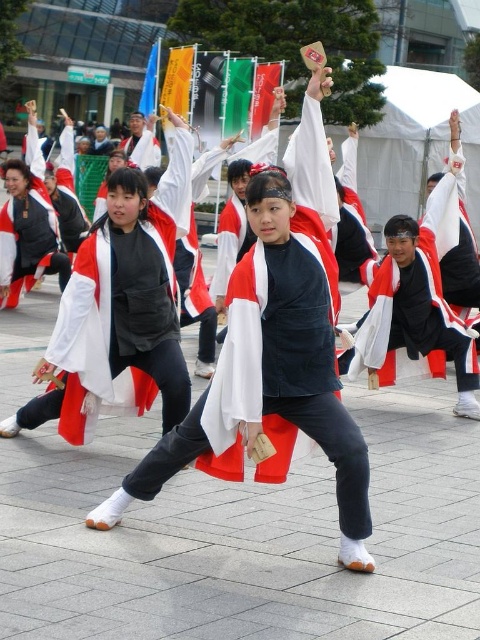
Question: Observing the image, what is the correct spatial positioning of matte black jacket at center in reference to white matte kimono at center?

Choices:
 (A) right
 (B) left

Answer: (A)

Question: Considering the relative positions of matte black jacket at center and white matte kimono at center in the image provided, where is matte black jacket at center located with respect to white matte kimono at center?

Choices:
 (A) right
 (B) left

Answer: (A)

Question: Which point is closer to the camera taking this photo?

Choices:
 (A) (304, 96)
 (B) (165, 324)

Answer: (B)

Question: Which object appears closest to the camera in this image?

Choices:
 (A) white matte kimono at center
 (B) matte black jacket at center

Answer: (B)

Question: Is matte black jacket at center below white matte kimono at center?

Choices:
 (A) no
 (B) yes

Answer: (B)